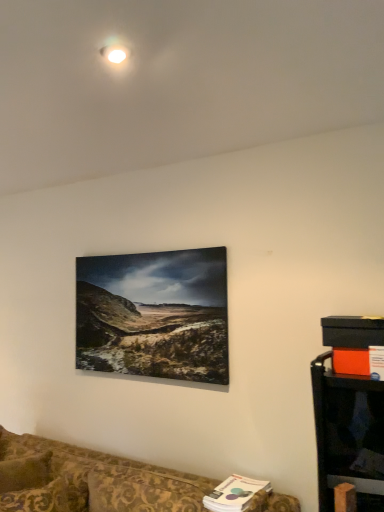
Question: Looking at the image, does patterned fabric couch at lower left seem bigger or smaller compared to black plastic entertainment center at lower right?

Choices:
 (A) small
 (B) big

Answer: (B)

Question: Would you say patterned fabric couch at lower left is to the left or to the right of black plastic entertainment center at lower right in the picture?

Choices:
 (A) right
 (B) left

Answer: (B)

Question: From a real-world perspective, is patterned fabric couch at lower left physically located above or below black plastic entertainment center at lower right?

Choices:
 (A) below
 (B) above

Answer: (A)

Question: Considering the relative positions of black plastic entertainment center at lower right and patterned fabric couch at lower left in the image provided, is black plastic entertainment center at lower right to the left or to the right of patterned fabric couch at lower left?

Choices:
 (A) right
 (B) left

Answer: (A)

Question: Considering the positions of black plastic entertainment center at lower right and patterned fabric couch at lower left in the image, is black plastic entertainment center at lower right bigger or smaller than patterned fabric couch at lower left?

Choices:
 (A) small
 (B) big

Answer: (A)

Question: Is black plastic entertainment center at lower right wider or thinner than patterned fabric couch at lower left?

Choices:
 (A) thin
 (B) wide

Answer: (A)

Question: Relative to patterned fabric couch at lower left, is black plastic entertainment center at lower right in front or behind?

Choices:
 (A) front
 (B) behind

Answer: (B)